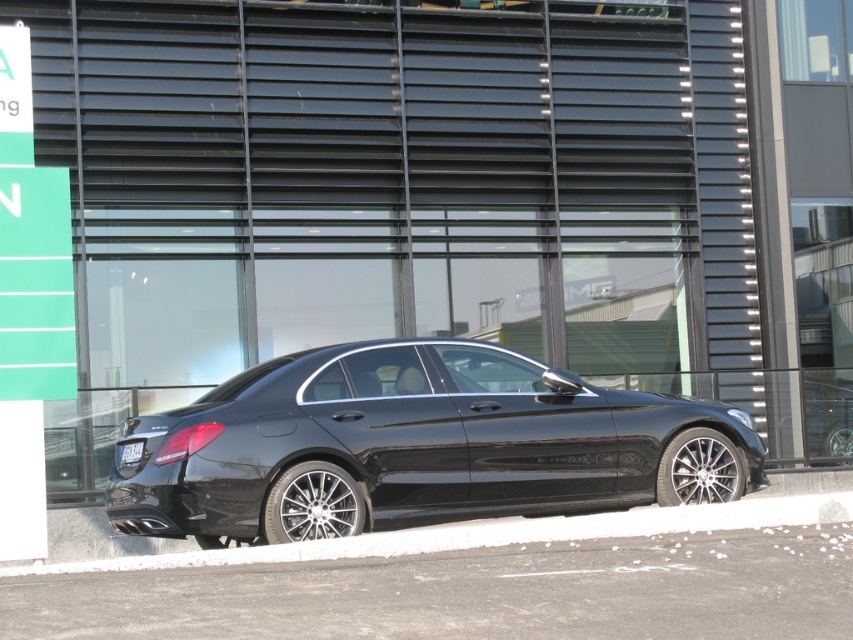
Looking at this image, you are a photographer setting up a tripod to take a picture of the black matte license plate at rear. The tripod has a maximum height adjustment of 1.2 meters. Given that the white painted concrete at lower center is part of the ground, will you need to adjust the tripod height to reach the license plate?

The white painted concrete at lower center has a greater height compared to the black matte license plate at rear. Since the concrete is part of the ground, the license plate is lower than the ground level, so the tripod does not need to be raised beyond its maximum height of 1.2 meters to capture the license plate.

You are standing in front of a modern building with a sleek black sedan parked nearby. You notice a specific point marked at coordinate (276, 451). If you want to reach this point without moving past the sedan, is it possible? Please explain based on the distance from the viewer.

The point at coordinate (276, 451) is 10.41 meters away from the viewer. Since the sedan is parked in front of the building, it is likely positioned between the viewer and the point. Therefore, reaching the point without moving past the sedan would not be possible as the sedan is blocking the direct path.